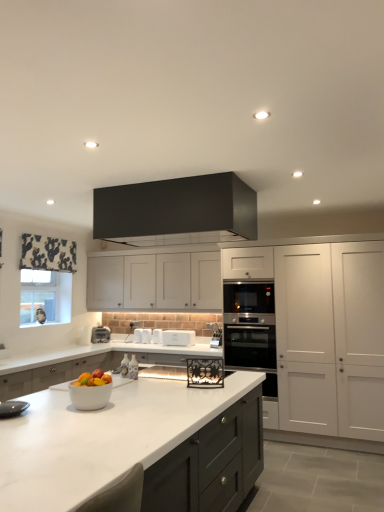
Question: Considering the positions of white plastic toaster at center and white matte cabinet at center, the first cabinetry in the back-to-front sequence, in the image, is white plastic toaster at center bigger or smaller than white matte cabinet at center, the first cabinetry in the back-to-front sequence,?

Choices:
 (A) small
 (B) big

Answer: (A)

Question: Is point (187, 340) positioned closer to the camera than point (170, 271)?

Choices:
 (A) closer
 (B) farther

Answer: (A)

Question: Based on their relative distances, which object is nearer to the satin silver oven at center, which appears as the second oven when viewed from the top?

Choices:
 (A) white plastic toaster at center, the 3th appliance when ordered from left to right
 (B) matte black range hood at upper center, which ranks as the third cabinetry in back-to-front order
 (C) shiny plastic bowl at center
 (D) white plastic toaster at center, which is the 3th appliance in right-to-left order
 (E) white matte cabinet at right, the second cabinetry viewed from the front

Answer: (E)

Question: Estimate the real-world distances between objects in this image. Which object is closer to the satin black oven at right, which is the 1th oven from top to bottom?

Choices:
 (A) clear glass window screen at left
 (B) white marble countertop at center
 (C) white matte toaster at center, which appears as the fourth appliance when viewed from the right
 (D) white plastic toaster at center, the 3th appliance when ordered from left to right
 (E) shiny plastic bowl at center

Answer: (D)